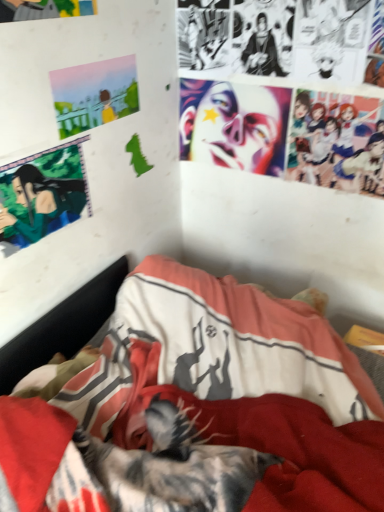
What do you see at coordinates (94, 94) in the screenshot? I see `pastel acrylic painting at upper left` at bounding box center [94, 94].

Describe the element at coordinates (38, 204) in the screenshot. I see `green matte anime character at upper left` at that location.

What is the approximate height of shiny plastic face at upper center?

shiny plastic face at upper center is 11.88 inches in height.

What do you see at coordinates (240, 129) in the screenshot? This screenshot has width=384, height=512. I see `shiny plastic face at upper center` at bounding box center [240, 129].

Find the location of a particular element. pastel acrylic painting at upper left is located at coordinates coord(94,94).

Considering the positions of points (240, 113) and (118, 450), is point (240, 113) closer to camera compared to point (118, 450)?

No, it is not.

Considering the sizes of shiny plastic face at upper center and textured fabric bed at center in the image, is shiny plastic face at upper center wider or thinner than textured fabric bed at center?

Clearly, shiny plastic face at upper center has less width compared to textured fabric bed at center.

The height and width of the screenshot is (512, 384). Identify the location of human face that appears behind the textured fabric bed at center. (240, 129).

Is shiny plastic face at upper center in front of or behind green matte anime character at upper left in the image?

Clearly, shiny plastic face at upper center is behind green matte anime character at upper left.

In the scene shown: Measure the distance between shiny plastic face at upper center and green matte anime character at upper left.

A distance of 24.69 inches exists between shiny plastic face at upper center and green matte anime character at upper left.

Is shiny plastic face at upper center next to green matte anime character at upper left?

No, shiny plastic face at upper center is not beside green matte anime character at upper left.

Is shiny plastic face at upper center taller or shorter than green matte anime character at upper left?

Considering their sizes, shiny plastic face at upper center has more height than green matte anime character at upper left.

Who is shorter, textured fabric bed at center or shiny plastic face at upper center?

shiny plastic face at upper center.

In the image, there is a textured fabric bed at center. In order to click on human face above it (from the image's perspective) in this screenshot , I will do `click(240, 129)`.

Considering the sizes of objects textured fabric bed at center and shiny plastic face at upper center in the image provided, who is wider, textured fabric bed at center or shiny plastic face at upper center?

With larger width is textured fabric bed at center.

From a real-world perspective, is pastel acrylic painting at upper left located higher than textured fabric bed at center?

Correct, in the physical world, pastel acrylic painting at upper left is higher than textured fabric bed at center.

Where is `bed below the pastel acrylic painting at upper left (from the image's perspective)`? bed below the pastel acrylic painting at upper left (from the image's perspective) is located at coordinates (201, 409).

Could textured fabric bed at center be considered to be inside pastel acrylic painting at upper left?

Actually, textured fabric bed at center is outside pastel acrylic painting at upper left.

Are pastel acrylic painting at upper left and textured fabric bed at center far apart?

They are positioned close to each other.

Is textured fabric bed at center at the left side of green matte anime character at upper left?

No, textured fabric bed at center is not to the left of green matte anime character at upper left.

From the image's perspective, relative to green matte anime character at upper left, is textured fabric bed at center above or below?

From the image's perspective, textured fabric bed at center appears below green matte anime character at upper left.

From a real-world perspective, between textured fabric bed at center and green matte anime character at upper left, who is vertically lower?

textured fabric bed at center, from a real-world perspective.

Does textured fabric bed at center turn towards pastel acrylic painting at upper left?

No, textured fabric bed at center does not turn towards pastel acrylic painting at upper left.

How different are the orientations of textured fabric bed at center and pastel acrylic painting at upper left in degrees?

The facing directions of textured fabric bed at center and pastel acrylic painting at upper left are 91.2 degrees apart.

From the image's perspective, which one is positioned lower, textured fabric bed at center or pastel acrylic painting at upper left?

textured fabric bed at center, from the image's perspective.

Is textured fabric bed at center in front of or behind pastel acrylic painting at upper left in the image?

textured fabric bed at center is positioned closer to the viewer than pastel acrylic painting at upper left.

Does green matte anime character at upper left have a lesser width compared to textured fabric bed at center?

Indeed, green matte anime character at upper left has a lesser width compared to textured fabric bed at center.

Is the depth of green matte anime character at upper left greater than that of textured fabric bed at center?

Yes, the depth of green matte anime character at upper left is greater than that of textured fabric bed at center.

Is green matte anime character at upper left positioned with its back to textured fabric bed at center?

green matte anime character at upper left is not turned away from textured fabric bed at center.

Which of these two, green matte anime character at upper left or textured fabric bed at center, stands taller?

With more height is textured fabric bed at center.

The image size is (384, 512). I want to click on human face above the textured fabric bed at center (from a real-world perspective), so click(240, 129).

Locate an element on the screen. The width and height of the screenshot is (384, 512). human face on the right of the green matte anime character at upper left is located at coordinates (240, 129).

When comparing their distances from pastel acrylic painting at upper left, does shiny plastic face at upper center or green matte anime character at upper left seem closer?

Among the two, green matte anime character at upper left is located nearer to pastel acrylic painting at upper left.

Estimate the real-world distances between objects in this image. Which object is closer to textured fabric bed at center, green matte anime character at upper left or shiny plastic face at upper center?

green matte anime character at upper left.

Considering their positions, is green matte anime character at upper left positioned closer to shiny plastic face at upper center than textured fabric bed at center?

green matte anime character at upper left lies closer to shiny plastic face at upper center than the other object.

Looking at the image, which one is located closer to textured fabric bed at center, pastel acrylic painting at upper left or shiny plastic face at upper center?

shiny plastic face at upper center lies closer to textured fabric bed at center than the other object.

From the image, which object appears to be nearer to green matte anime character at upper left, pastel acrylic painting at upper left or shiny plastic face at upper center?

pastel acrylic painting at upper left lies closer to green matte anime character at upper left than the other object.

Considering their positions, is shiny plastic face at upper center positioned closer to green matte anime character at upper left than textured fabric bed at center?

textured fabric bed at center is positioned closer to the anchor green matte anime character at upper left.

Estimate the real-world distances between objects in this image. Which object is further from green matte anime character at upper left, textured fabric bed at center or pastel acrylic painting at upper left?

Among the two, textured fabric bed at center is located further to green matte anime character at upper left.

Estimate the real-world distances between objects in this image. Which object is closer to green matte anime character at upper left, shiny plastic face at upper center or pastel acrylic painting at upper left?

Based on the image, pastel acrylic painting at upper left appears to be nearer to green matte anime character at upper left.

The width and height of the screenshot is (384, 512). Find the location of `poster page between green matte anime character at upper left and shiny plastic face at upper center in the horizontal direction`. poster page between green matte anime character at upper left and shiny plastic face at upper center in the horizontal direction is located at coordinates (94, 94).

You are a GUI agent. You are given a task and a screenshot of the screen. Output one action in this format:
    pyautogui.click(x=<x>, y=<y>)
    Task: Click on the person between pastel acrylic painting at upper left and textured fabric bed at center in the vertical direction
    The width and height of the screenshot is (384, 512).
    Given the screenshot: What is the action you would take?
    pyautogui.click(x=38, y=204)

The image size is (384, 512). I want to click on human face between pastel acrylic painting at upper left and textured fabric bed at center from top to bottom, so click(240, 129).

Identify the location of person between shiny plastic face at upper center and textured fabric bed at center vertically. This screenshot has width=384, height=512. (38, 204).